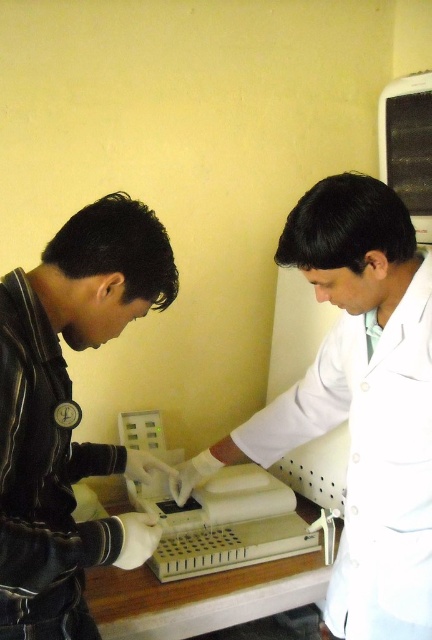
Question: Is white lab coat at center to the right of white matte gloves at left from the viewer's perspective?

Choices:
 (A) yes
 (B) no

Answer: (A)

Question: Which point is farther to the camera?

Choices:
 (A) white plastic test tubes at center
 (B) white matte gloves at left
 (C) white lab coat at center

Answer: (A)

Question: Which point is closer to the camera taking this photo?

Choices:
 (A) (45, 628)
 (B) (168, 452)

Answer: (A)

Question: Is white lab coat at center positioned at the back of white matte gloves at left?

Choices:
 (A) no
 (B) yes

Answer: (B)

Question: Which point is farther from the camera taking this photo?

Choices:
 (A) (409, 381)
 (B) (256, 483)
 (C) (137, 545)

Answer: (B)

Question: Where is white lab coat at center located in relation to white matte gloves at left in the image?

Choices:
 (A) left
 (B) right

Answer: (B)